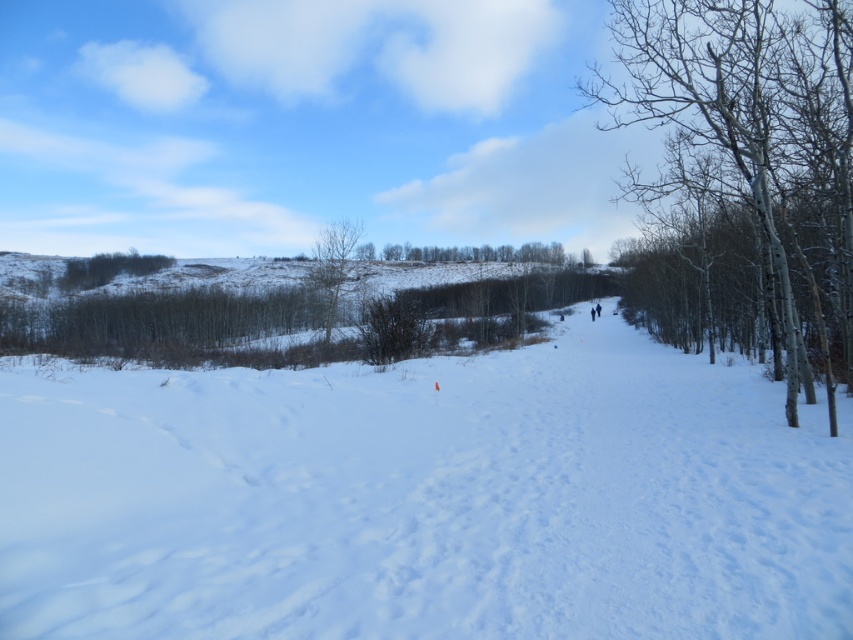
Question: In this image, where is bare white tree at right located relative to bare branches at center?

Choices:
 (A) below
 (B) above

Answer: (B)

Question: Is bare branches at center below green leafless tree at center?

Choices:
 (A) no
 (B) yes

Answer: (B)

Question: Which of the following is the closest to the observer?

Choices:
 (A) pos(460,259)
 (B) pos(341,248)
 (C) pos(757,120)

Answer: (C)

Question: Among these points, which one is nearest to the camera?

Choices:
 (A) (329, 288)
 (B) (471, 259)
 (C) (756, 157)

Answer: (C)

Question: Does bare white tree at right appear over green leafless tree at center?

Choices:
 (A) yes
 (B) no

Answer: (A)

Question: Among these points, which one is farthest from the camera?

Choices:
 (A) (746, 104)
 (B) (540, 257)
 (C) (341, 257)

Answer: (B)